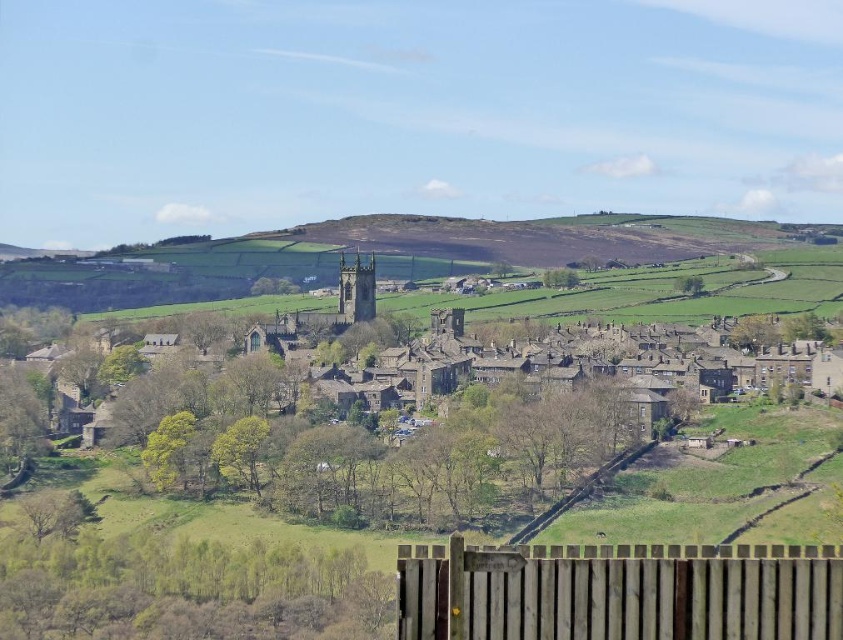
Can you confirm if brown stone buildings at center is wider than brown wooden fence at lower center?

Yes.

Is brown stone buildings at center to the left of brown wooden fence at lower center from the viewer's perspective?

Yes, brown stone buildings at center is to the left of brown wooden fence at lower center.

Find the location of a particular element. brown stone buildings at center is located at coordinates (446, 369).

Locate an element on the screen. Image resolution: width=843 pixels, height=640 pixels. brown stone buildings at center is located at coordinates (446, 369).